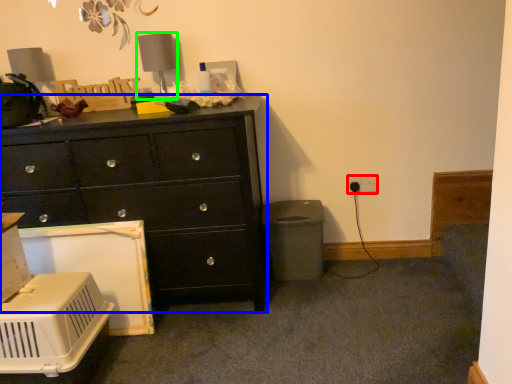
Question: Estimate the real-world distances between objects in this image. Which object is farther from electric outlet (highlighted by a red box), chest of drawers (highlighted by a blue box) or table lamp (highlighted by a green box)?

Choices:
 (A) chest of drawers
 (B) table lamp

Answer: (B)